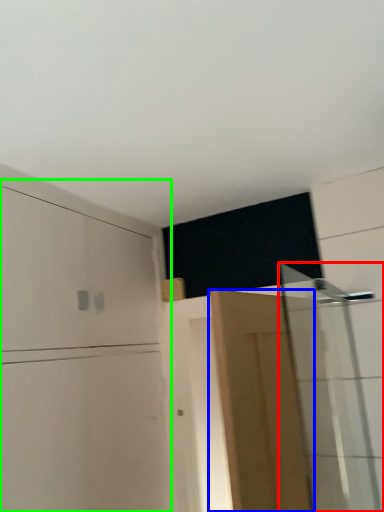
Question: Considering the real-world distances, which object is closest to shower door (highlighted by a red box)? door (highlighted by a blue box) or dresser (highlighted by a green box).

Choices:
 (A) door
 (B) dresser

Answer: (A)